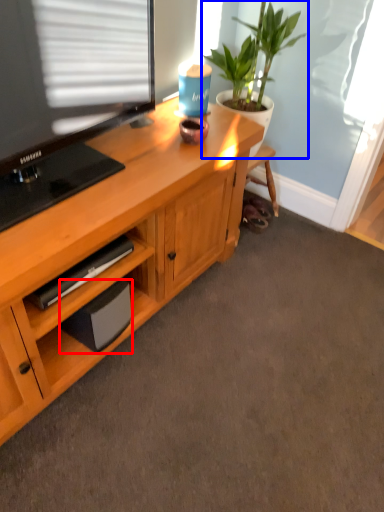
Question: Which point is further to the camera, speaker (highlighted by a red box) or houseplant (highlighted by a blue box)?

Choices:
 (A) speaker
 (B) houseplant

Answer: (B)